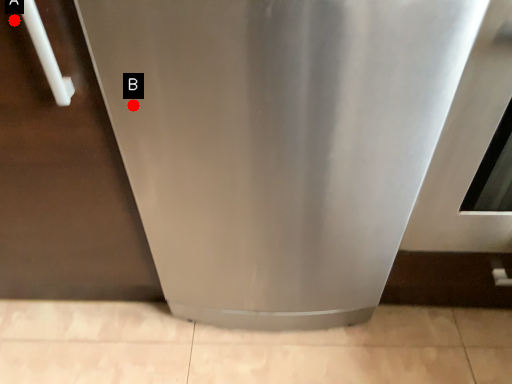
Question: Two points are circled on the image, labeled by A and B beside each circle. Which point appears farthest from the camera in this image?

Choices:
 (A) A is further
 (B) B is further

Answer: (B)